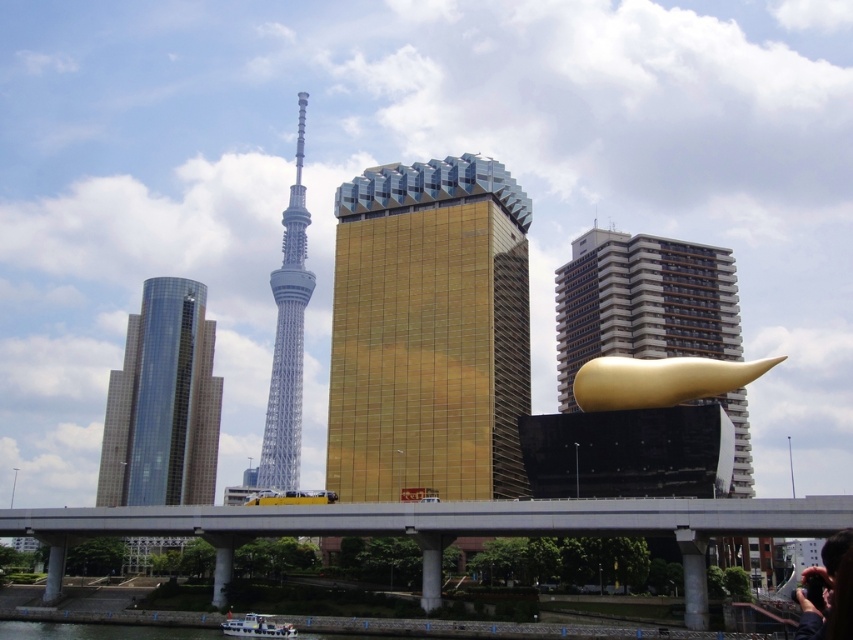
You are a city planner evaluating the urban layout. Considering the shiny glass skyscraper at left and the white plastic boat at lower left, which object occupies a bigger space in the scene?

The shiny glass skyscraper at left has a larger size compared to the white plastic boat at lower left, so it occupies a bigger space in the scene.

You are standing at a viewpoint where you can see the two points labeled as point (428,432) and point (260,460). Which of these points is closer to you?

Point (428,432) is closer to you because it is in front of point (260,460).